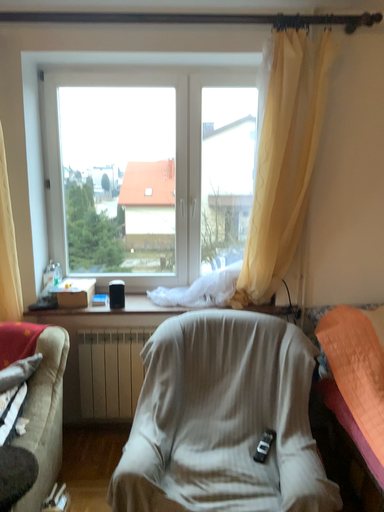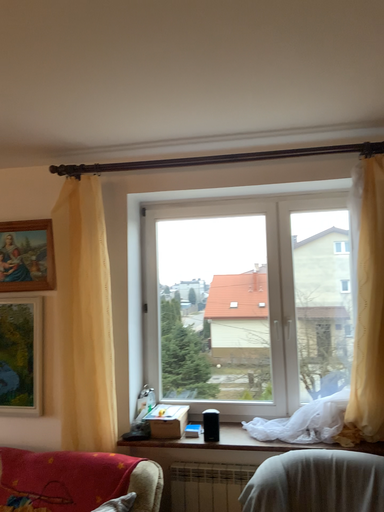
Question: How did the camera likely rotate when shooting the video?

Choices:
 (A) rotated left
 (B) rotated right

Answer: (A)